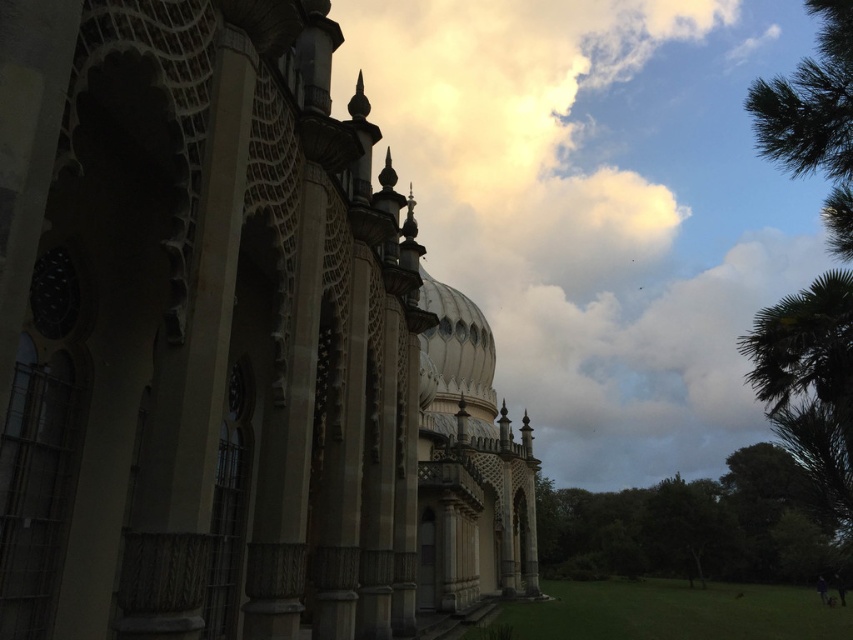
You are a photographer planning to capture the stone mosaic palace at center and the green leafy tree at lower right in a single frame. Based on their sizes, which object should you place closer to the camera to ensure both fit within the frame?

Since the stone mosaic palace at center is narrower than the green leafy tree at lower right, you should position the stone mosaic palace at center closer to the camera to ensure both fit within the frame.

You are standing in front of the building and notice the green leafy tree at lower right and the white textured dome at center. Which object is positioned lower in the image?

The green leafy tree at lower right is positioned below the white textured dome at center, so the green leafy tree at lower right is lower in the image.